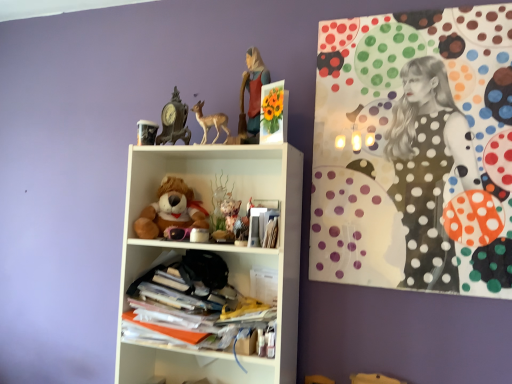
Question: In which direction should I rotate to look at white matte shelf at center, which is the 1th shelf from top to bottom?

Choices:
 (A) right
 (B) left

Answer: (B)

Question: Is matte plastic figurine at upper center completely or partially inside matte brown deer at upper center?

Choices:
 (A) yes
 (B) no

Answer: (B)

Question: Is matte brown deer at upper center far away from matte plastic figurine at upper center?

Choices:
 (A) yes
 (B) no

Answer: (B)

Question: Is matte brown deer at upper center turned away from matte plastic figurine at upper center?

Choices:
 (A) no
 (B) yes

Answer: (A)

Question: Would you say matte brown deer at upper center is outside matte plastic figurine at upper center?

Choices:
 (A) no
 (B) yes

Answer: (B)

Question: Can you confirm if matte brown deer at upper center is taller than matte plastic figurine at upper center?

Choices:
 (A) no
 (B) yes

Answer: (A)

Question: Is matte brown deer at upper center beside matte plastic figurine at upper center?

Choices:
 (A) yes
 (B) no

Answer: (B)

Question: Is matte plastic figurine at upper center located outside antique bronze clock at upper center?

Choices:
 (A) no
 (B) yes

Answer: (B)

Question: Is matte plastic figurine at upper center to the right of antique bronze clock at upper center from the viewer's perspective?

Choices:
 (A) yes
 (B) no

Answer: (A)

Question: Does matte plastic figurine at upper center have a larger size compared to antique bronze clock at upper center?

Choices:
 (A) yes
 (B) no

Answer: (A)

Question: From a real-world perspective, is matte plastic figurine at upper center on top of antique bronze clock at upper center?

Choices:
 (A) yes
 (B) no

Answer: (A)

Question: Can you confirm if matte plastic figurine at upper center is smaller than antique bronze clock at upper center?

Choices:
 (A) yes
 (B) no

Answer: (B)

Question: Is matte plastic figurine at upper center positioned before antique bronze clock at upper center?

Choices:
 (A) no
 (B) yes

Answer: (B)

Question: Is matte brown deer at upper center thinner than stacked papers at center, which is the 1th shelf in bottom-to-top order?

Choices:
 (A) yes
 (B) no

Answer: (A)